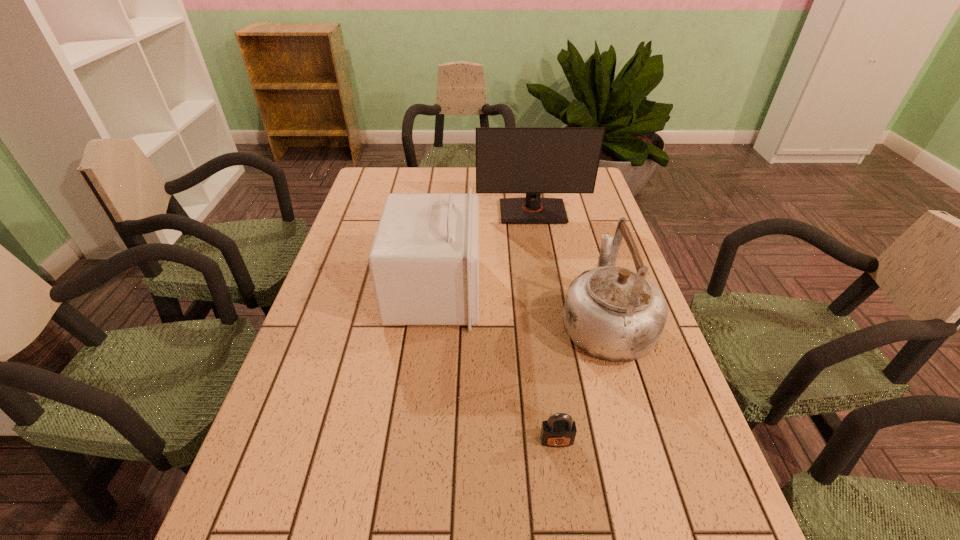
Locate an element on the screen. monitor is located at coordinates (533, 160).

You are a GUI agent. You are given a task and a screenshot of the screen. Output one action in this format:
    pyautogui.click(x=<x>, y=<y>)
    Task: Click on the kettle
    This screenshot has width=960, height=540.
    Given the screenshot: What is the action you would take?
    pyautogui.click(x=612, y=313)

This screenshot has height=540, width=960. Find the location of `the first-aid kit`. the first-aid kit is located at coordinates (424, 261).

Locate an element on the screen. The height and width of the screenshot is (540, 960). the shortest object is located at coordinates (559, 430).

You are a GUI agent. You are given a task and a screenshot of the screen. Output one action in this format:
    pyautogui.click(x=<x>, y=<y>)
    Task: Click on the padlock
    
    Given the screenshot: What is the action you would take?
    pyautogui.click(x=559, y=430)

Identify the location of vacant space located on the screen side of the farthest object. (545, 286).

Where is `free space located at the spout of the kettle`? This screenshot has width=960, height=540. free space located at the spout of the kettle is located at coordinates (580, 235).

This screenshot has width=960, height=540. In order to click on free region located 0.360m at the spout of the kettle in this screenshot , I will do `click(573, 212)`.

At what (x,y) coordinates should I click in order to perform the action: click on vacant space located 0.350m at the spout of the kettle. Please return your answer as a coordinate pair (x, y). This screenshot has width=960, height=540. Looking at the image, I should click on (574, 214).

Where is `vacant area located on the front-facing side of the first-aid kit`? The width and height of the screenshot is (960, 540). vacant area located on the front-facing side of the first-aid kit is located at coordinates (550, 291).